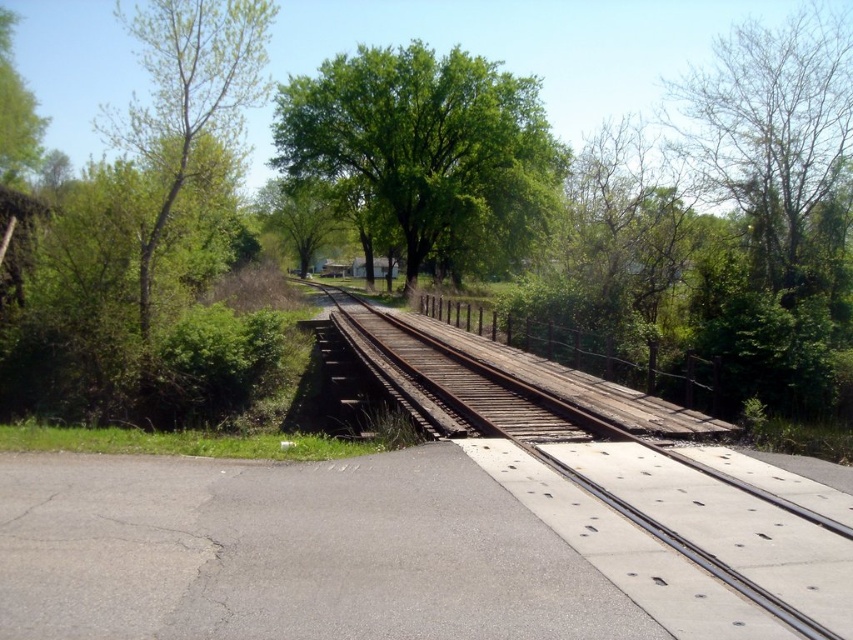
Is bare wood tree at upper right taller than green leafy tree at left?

Incorrect, bare wood tree at upper right's height is not larger of green leafy tree at left's.

Which is more to the right, bare wood tree at upper right or green leafy tree at left?

Positioned to the right is bare wood tree at upper right.

Is point (740, 134) farther from viewer compared to point (184, 13)?

Yes.

Identify the location of bare wood tree at upper right. (776, 138).

Does rusty metal train track at center have a greater height compared to bare wood tree at upper right?

No.

How much distance is there between rusty metal train track at center and bare wood tree at upper right?

16.34 meters

Find the location of a particular element. rusty metal train track at center is located at coordinates (624, 483).

Who is more distant from viewer, (693, 70) or (296, 200)?

The point (693, 70) is behind.

Is bare wood tree at upper right bigger than green leafy tree at center?

Yes, bare wood tree at upper right is bigger than green leafy tree at center.

You are a GUI agent. You are given a task and a screenshot of the screen. Output one action in this format:
    pyautogui.click(x=<x>, y=<y>)
    Task: Click on the bare wood tree at upper right
    Image resolution: width=853 pixels, height=640 pixels.
    Given the screenshot: What is the action you would take?
    tap(776, 138)